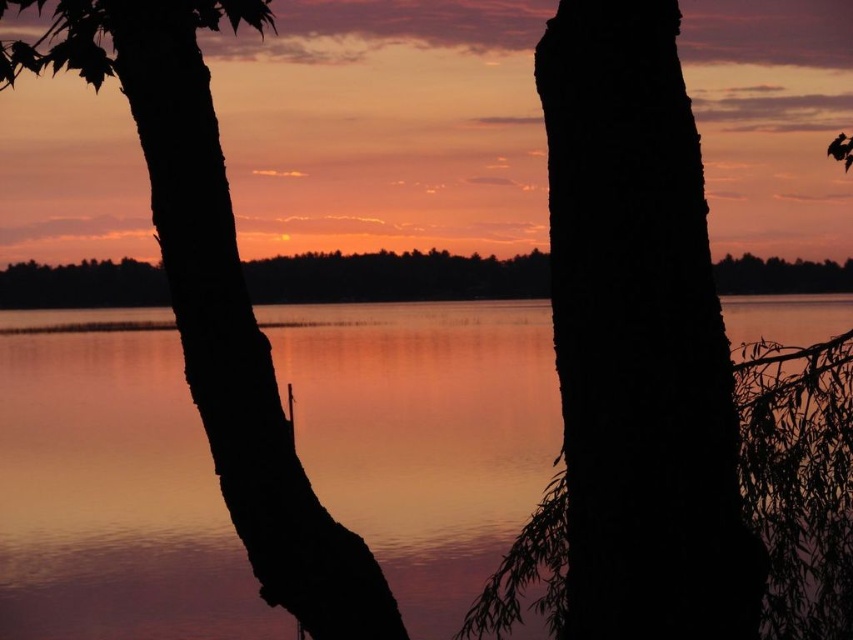
Question: Which object is the farthest from the smooth water at center?

Choices:
 (A) black matte tree trunk at left
 (B) black rough bark at center

Answer: (A)

Question: Considering the real-world distances, which object is closest to the black matte tree trunk at left?

Choices:
 (A) smooth water at center
 (B) black rough bark at center

Answer: (B)

Question: Is black rough bark at center below black matte tree trunk at left?

Choices:
 (A) yes
 (B) no

Answer: (A)

Question: Which of the following is the closest to the observer?

Choices:
 (A) (433, 467)
 (B) (579, 340)

Answer: (B)

Question: Can you confirm if smooth water at center is bigger than black rough bark at center?

Choices:
 (A) no
 (B) yes

Answer: (B)

Question: Does smooth water at center appear under black matte tree trunk at left?

Choices:
 (A) yes
 (B) no

Answer: (A)